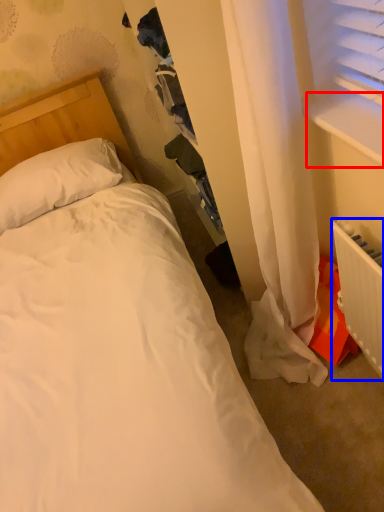
Question: Among these objects, which one is nearest to the camera, window sill (highlighted by a red box) or radiator (highlighted by a blue box)?

Choices:
 (A) window sill
 (B) radiator

Answer: (A)